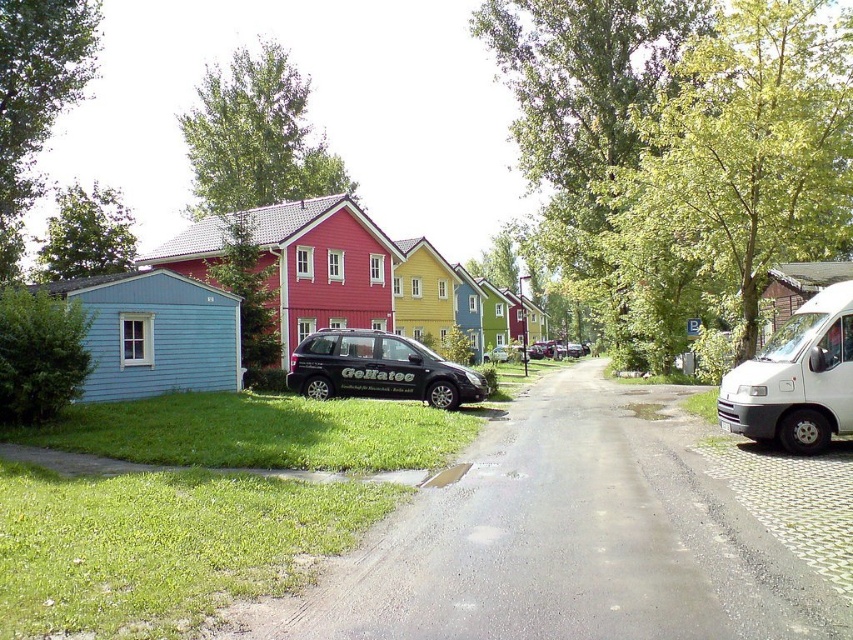
You are standing at the center of the residential street. You need to walk to the white matte van at right. Which direction should you head?

You should head to the right since the white matte van at right is located at point (x=796, y=378), which is to the right side of the street.

You are a delivery driver who needs to park your delivery truck between the white matte van at right and the black matte minivan at center. The delivery truck is 5 meters long. Is there enough space between them to park your truck?

The white matte van at right occupies less space than the black matte minivan at center. However, the exact distance between them isn t provided in the description, so it s impossible to determine if there s enough space for a 5 meter truck.

You are standing on the residential street and want to walk towards the two points marked in the image. Which point, point [787,396] or point [426,364], will you reach first?

You will reach point [787,396] first because it is closer to the viewer than point [426,364].